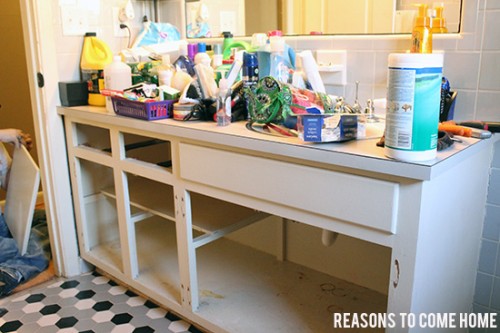
Locate an element on the screen. The height and width of the screenshot is (333, 500). square tile wall is located at coordinates (479, 73).